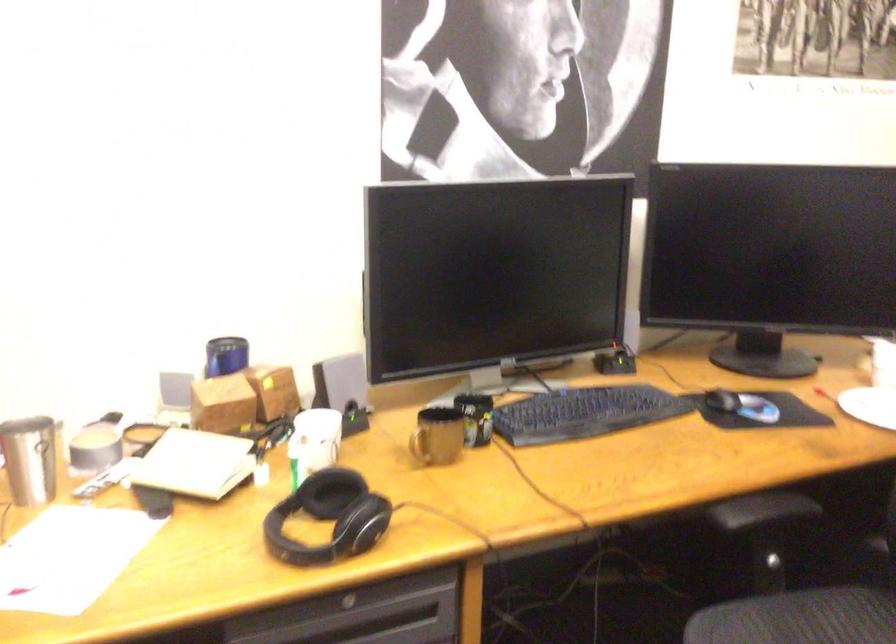
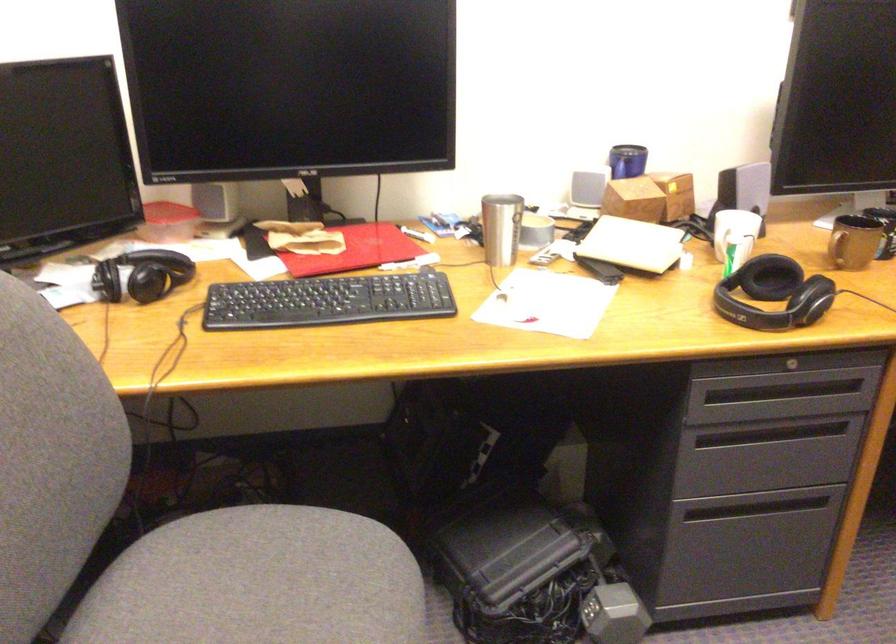
Where in the second image is the point corresponding to the point at 220,410 from the first image?

(633, 200)